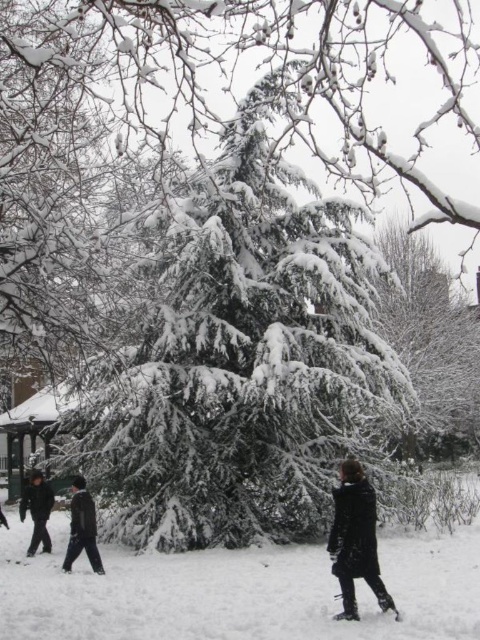
Based on the coordinates provided, can you identify which object in the scene corresponds to the point (238, 589)?

The point (238, 589) corresponds to the white fluffy snow at center.

You are standing in the winter scene and want to find the closest person to you. Which one is closer, the black matte coat at lower right or the black matte jacket at lower left?

The black matte coat at lower right is located above the black matte jacket at lower left, meaning it is closer to you. Therefore, the black matte coat at lower right is the closer one.